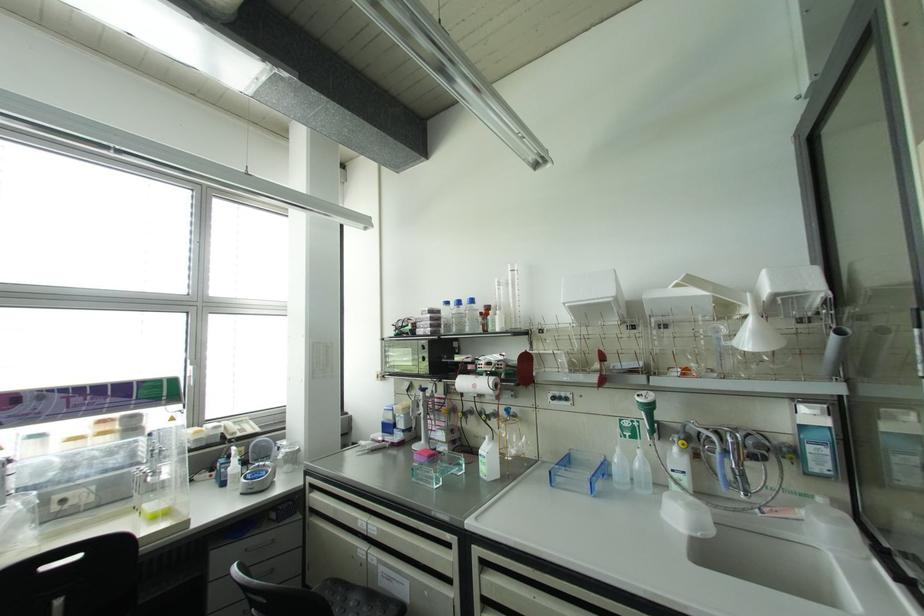
The height and width of the screenshot is (616, 924). Describe the element at coordinates (358, 599) in the screenshot. I see `the chair sitting surface` at that location.